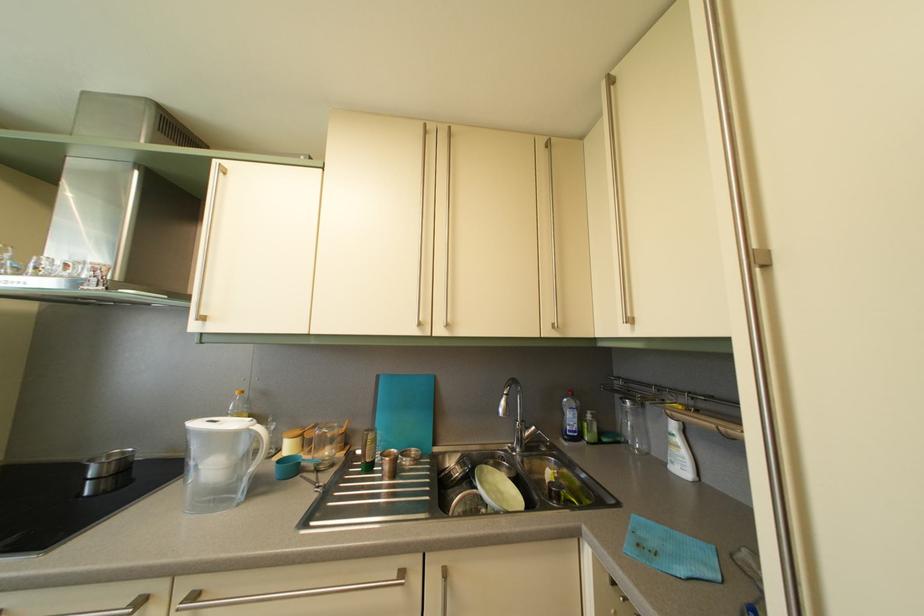
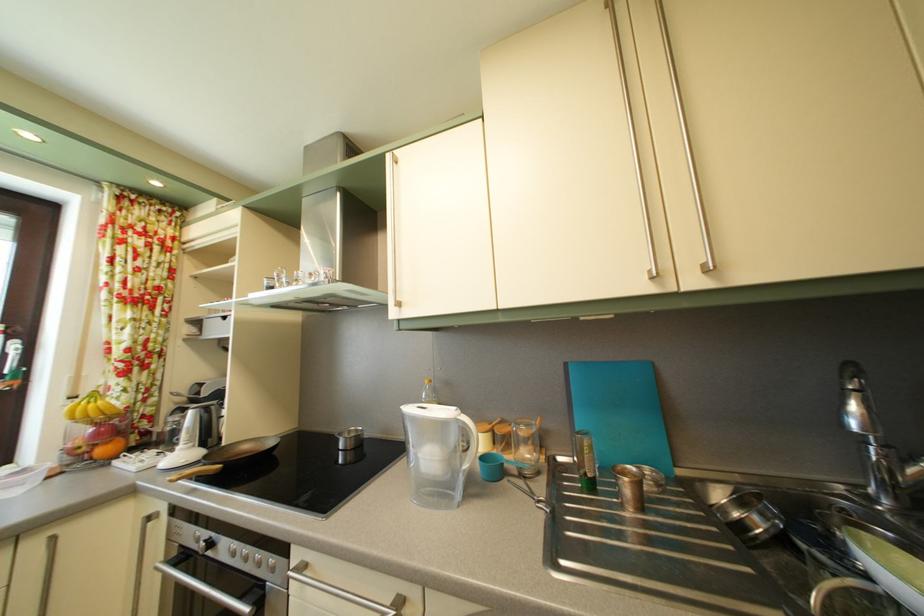
Which direction would the cameraman need to move to produce the second image?

The movement direction of the cameraman is left, forward.